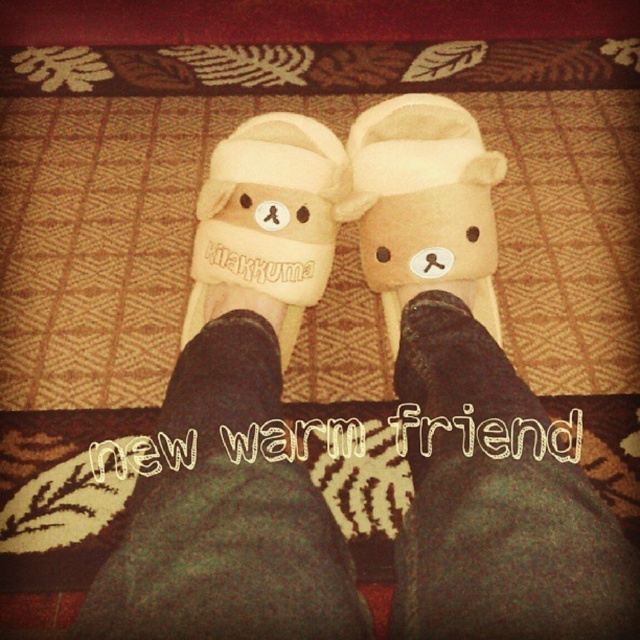
You are standing in a room and see two beige slippers at the center. Which one is closer to you, the beige soft plush bear slipper at center or the beige fabric slipper at center?

The beige soft plush bear slipper at center is closer to the viewer than the beige fabric slipper at center.

What are the coordinates of the beige soft plush bear slipper at center?

The beige soft plush bear slipper at center is located at coordinates point (x=422, y=205).